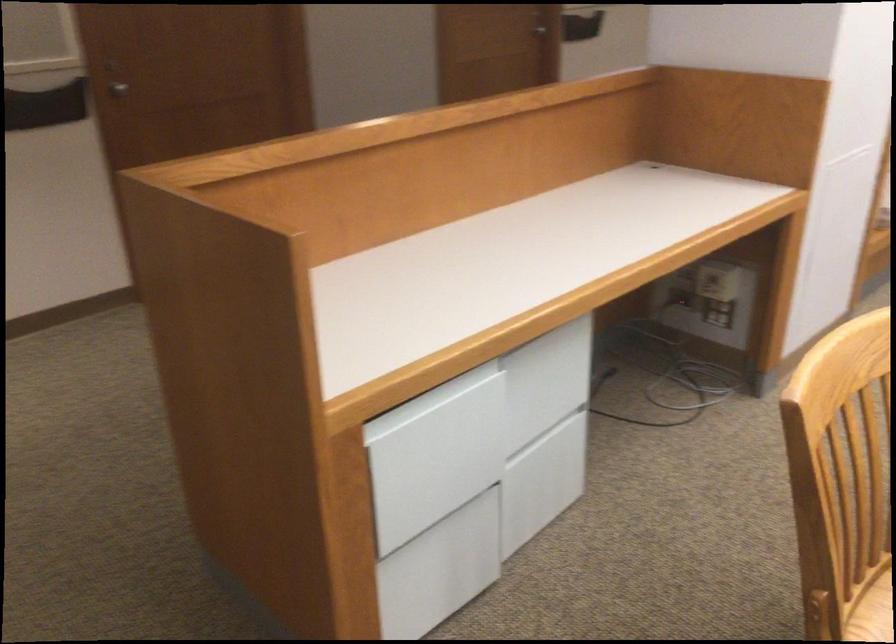
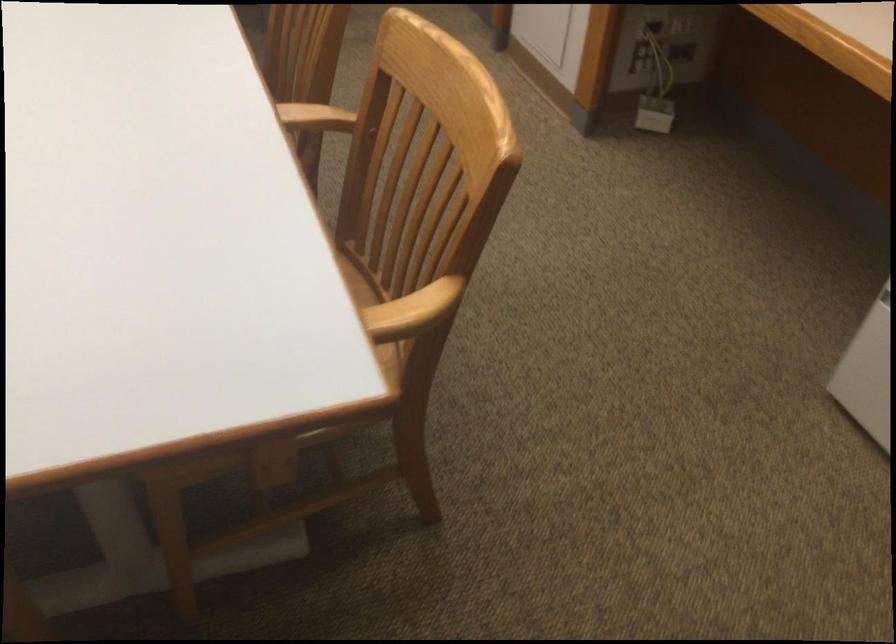
The images are taken continuously from a first-person perspective. In which direction is your viewpoint rotating?

The camera rotated toward right-down.